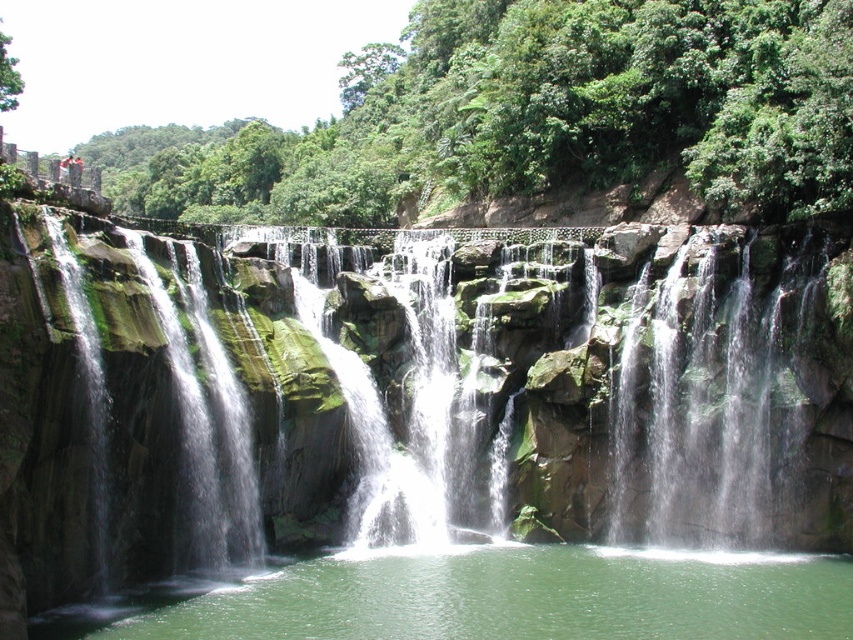
Can you confirm if green mossy rocks at center is thinner than green liquid water at center?

No.

Can you confirm if green mossy rocks at center is taller than green liquid water at center?

Indeed, green mossy rocks at center has a greater height compared to green liquid water at center.

You are a GUI agent. You are given a task and a screenshot of the screen. Output one action in this format:
    pyautogui.click(x=<x>, y=<y>)
    Task: Click on the green mossy rocks at center
    
    Given the screenshot: What is the action you would take?
    pyautogui.click(x=405, y=396)

This screenshot has height=640, width=853. Identify the location of green mossy rocks at center. (405, 396).